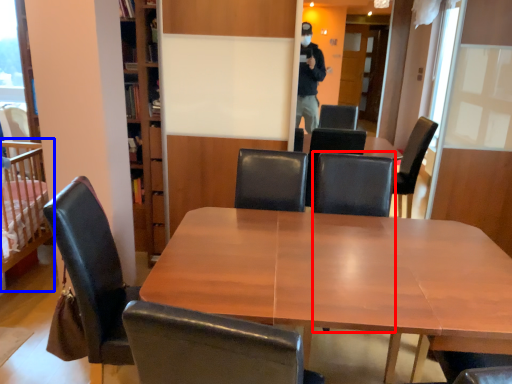
Question: Which object appears closest to the camera in this image, armchair (highlighted by a red box) or infant bed (highlighted by a blue box)?

Choices:
 (A) armchair
 (B) infant bed

Answer: (A)